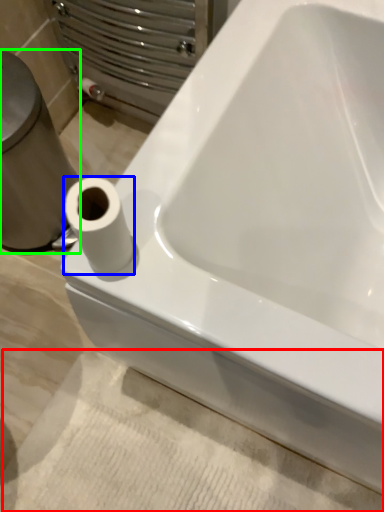
Question: Which object is positioned closest to bath mat (highlighted by a red box)? Select from toilet paper (highlighted by a blue box) and porcelain (highlighted by a green box).

Choices:
 (A) toilet paper
 (B) porcelain

Answer: (B)